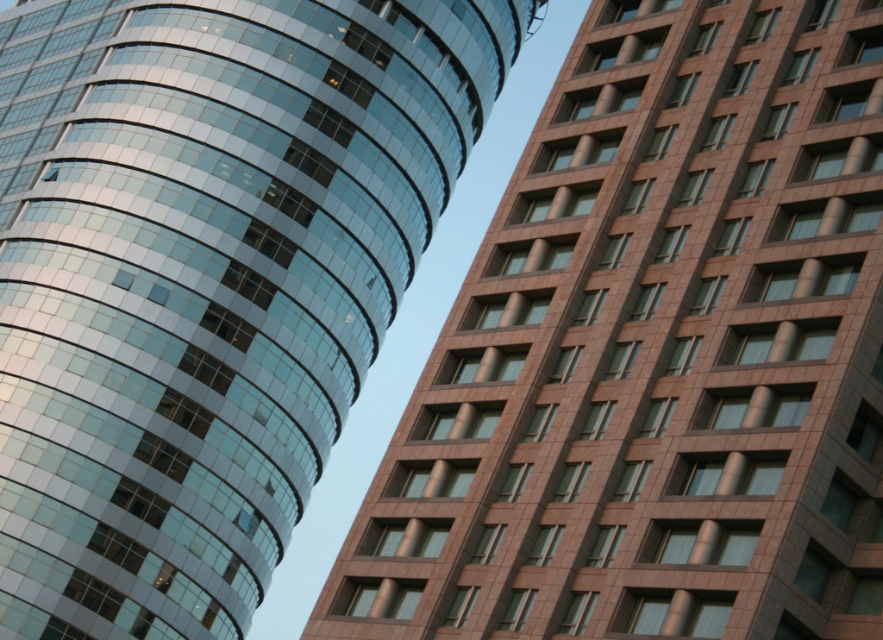
Is glassy reflective tower at left thinner than shiny glass building at upper left?

Yes, glassy reflective tower at left is thinner than shiny glass building at upper left.

Can you confirm if glassy reflective tower at left is taller than shiny glass building at upper left?

No, glassy reflective tower at left is not taller than shiny glass building at upper left.

Which is behind, point (478, 580) or point (136, 195)?

Positioned behind is point (136, 195).

At what (x,y) coordinates should I click in order to perform the action: click on glassy reflective tower at left. Please return your answer as a coordinate pair (x, y). This screenshot has height=640, width=883. Looking at the image, I should click on (655, 353).